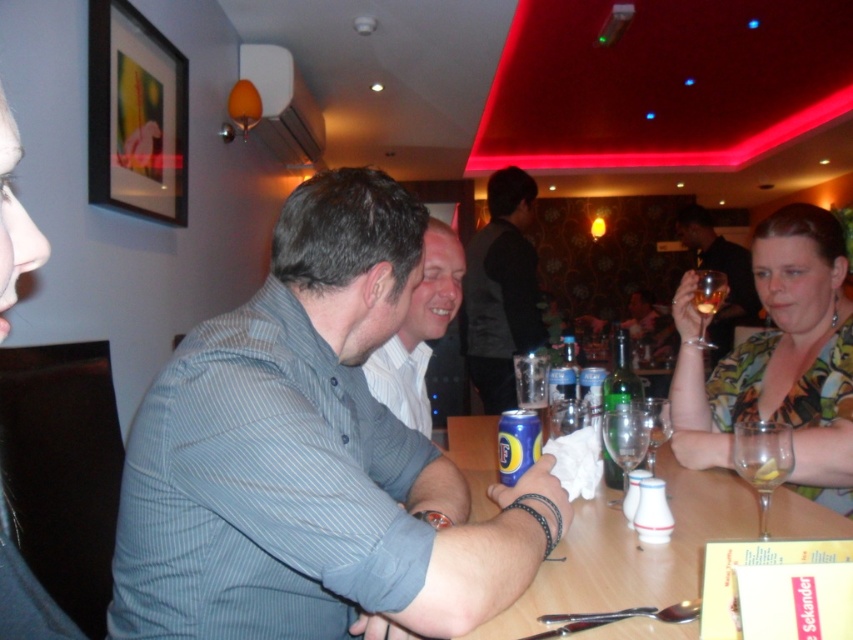
Who is positioned more to the right, dark gray vest at center or matte green dress at center?

dark gray vest at center is more to the right.

Identify the location of dark gray vest at center. Image resolution: width=853 pixels, height=640 pixels. (502, 291).

I want to click on dark gray vest at center, so click(x=502, y=291).

Consider the image. Does printed fabric blouse at right come behind wooden table at center?

Yes, it is.

In order to click on printed fabric blouse at right in this screenshot , I will do `click(778, 358)`.

Identify the location of printed fabric blouse at right. (778, 358).

Between point (454, 253) and point (770, 435), which one is positioned in front?

Positioned in front is point (770, 435).

Between point (442, 285) and point (759, 454), which one is positioned in front?

Positioned in front is point (759, 454).

Locate an element on the screen. This screenshot has width=853, height=640. light blue shirt at center is located at coordinates (419, 332).